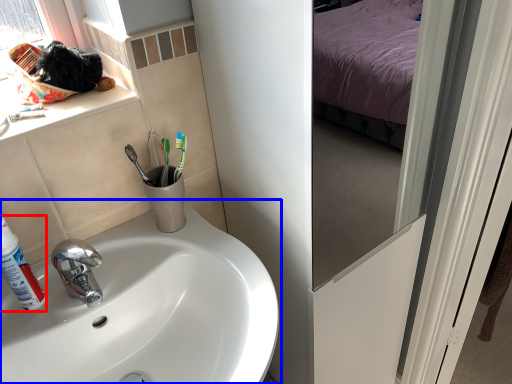
Question: Which point is further to the camera, shaving cream (highlighted by a red box) or sink (highlighted by a blue box)?

Choices:
 (A) shaving cream
 (B) sink

Answer: (A)